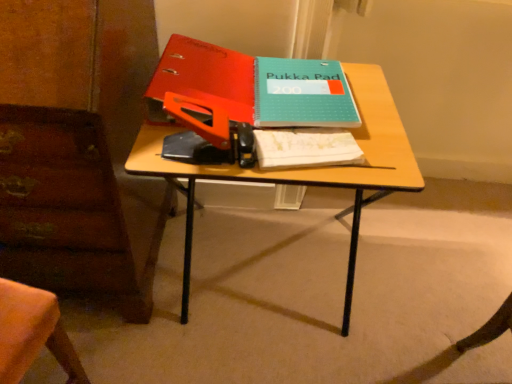
What are the coordinates of `matte orange binder at upper center, which appears as the 1th paperback book when viewed from the left` in the screenshot? It's located at (206, 76).

This screenshot has width=512, height=384. What do you see at coordinates (306, 168) in the screenshot?
I see `wooden desk at center` at bounding box center [306, 168].

This screenshot has width=512, height=384. I want to click on wooden desk at center, so click(306, 168).

Locate an element on the screen. This screenshot has width=512, height=384. teal matte notebook at center, which is the second paperback book from left to right is located at coordinates (302, 94).

Locate an element on the screen. The height and width of the screenshot is (384, 512). white paper notebook at center is located at coordinates (305, 148).

Is wooden desk at center turned away from white paper notebook at center?

wooden desk at center does not have its back to white paper notebook at center.

Is wooden desk at center far from white paper notebook at center?

No, there isn't a large distance between wooden desk at center and white paper notebook at center.

Where is `desk below the white paper notebook at center (from a real-world perspective)`? This screenshot has width=512, height=384. desk below the white paper notebook at center (from a real-world perspective) is located at coordinates (306, 168).

Considering the relative positions of wooden desk at center and white paper notebook at center in the image provided, is wooden desk at center behind white paper notebook at center?

No, wooden desk at center is closer to the camera.

Which object is thinner, white paper notebook at center or teal matte notebook at center, which ranks as the 1th paperback book in right-to-left order?

white paper notebook at center.

From the image's perspective, between white paper notebook at center and teal matte notebook at center, which is the second paperback book from left to right, which one is located above?

teal matte notebook at center, which is the second paperback book from left to right, appears higher in the image.

Based on the photo, can teal matte notebook at center, which ranks as the 1th paperback book in right-to-left order, be found inside white paper notebook at center?

Definitely not — teal matte notebook at center, which ranks as the 1th paperback book in right-to-left order, is not inside white paper notebook at center.

Could you tell me if matte orange binder at upper center, which appears as the 1th paperback book when viewed from the left, is turned towards teal matte notebook at center, which is the second paperback book from left to right?

Answer: No, matte orange binder at upper center, which appears as the 1th paperback book when viewed from the left, is not facing towards teal matte notebook at center, which is the second paperback book from left to right.

Considering their positions, is matte orange binder at upper center, which appears as the 1th paperback book when viewed from the left, located in front of or behind teal matte notebook at center, which is the second paperback book from left to right?

matte orange binder at upper center, which appears as the 1th paperback book when viewed from the left, is positioned closer to the viewer than teal matte notebook at center, which is the second paperback book from left to right.

How different are the orientations of matte orange binder at upper center, which appears as the 1th paperback book when viewed from the left, and teal matte notebook at center, which ranks as the 1th paperback book in right-to-left order, in degrees?

There is a 3.36-degree angle between the facing directions of matte orange binder at upper center, which appears as the 1th paperback book when viewed from the left, and teal matte notebook at center, which ranks as the 1th paperback book in right-to-left order.

Who is taller, matte orange binder at upper center, which appears as the 1th paperback book when viewed from the left, or teal matte notebook at center, which is the second paperback book from left to right?

matte orange binder at upper center, which appears as the 1th paperback book when viewed from the left, is taller.

Looking at this image, in terms of size, does matte orange binder at upper center, the 2th paperback book viewed from the right, appear bigger or smaller than white paper notebook at center?

Clearly, matte orange binder at upper center, the 2th paperback book viewed from the right, is larger in size than white paper notebook at center.

From the picture: Could you measure the distance between matte orange binder at upper center, the 2th paperback book viewed from the right, and white paper notebook at center?

matte orange binder at upper center, the 2th paperback book viewed from the right, and white paper notebook at center are 8.10 inches apart.

How many degrees apart are the facing directions of matte orange binder at upper center, the 2th paperback book viewed from the right, and white paper notebook at center?

Result: 11.4 degrees separate the facing orientations of matte orange binder at upper center, the 2th paperback book viewed from the right, and white paper notebook at center.

Which of these two, matte orange binder at upper center, which appears as the 1th paperback book when viewed from the left, or white paper notebook at center, is wider?

Wider between the two is matte orange binder at upper center, which appears as the 1th paperback book when viewed from the left.

Is point (353, 163) more distant than point (376, 182)?

Yes, point (353, 163) is farther from viewer.

Is white paper notebook at center with wooden desk at center?

Yes, white paper notebook at center and wooden desk at center clearly make contact.

In the image, is white paper notebook at center on the left side or the right side of wooden desk at center?

Based on their positions, white paper notebook at center is located to the right of wooden desk at center.

Looking at this image, from a real-world perspective, between white paper notebook at center and wooden desk at center, who is vertically higher?

white paper notebook at center is physically above.

Does teal matte notebook at center, which is the second paperback book from left to right, appear on the right side of matte orange binder at upper center, which appears as the 1th paperback book when viewed from the left?

Yes.

In the scene shown: Are teal matte notebook at center, which ranks as the 1th paperback book in right-to-left order, and matte orange binder at upper center, the 2th paperback book viewed from the right, located far from each other?

No, there isn't a large distance between teal matte notebook at center, which ranks as the 1th paperback book in right-to-left order, and matte orange binder at upper center, the 2th paperback book viewed from the right.

How different are the orientations of teal matte notebook at center, which ranks as the 1th paperback book in right-to-left order, and matte orange binder at upper center, the 2th paperback book viewed from the right, in degrees?

The angle between the facing direction of teal matte notebook at center, which ranks as the 1th paperback book in right-to-left order, and the facing direction of matte orange binder at upper center, the 2th paperback book viewed from the right, is 3.36 degrees.

From the image's perspective, which one is positioned lower, teal matte notebook at center, which is the second paperback book from left to right, or matte orange binder at upper center, the 2th paperback book viewed from the right?

teal matte notebook at center, which is the second paperback book from left to right, from the image's perspective.

From a real-world perspective, is wooden desk at center physically below teal matte notebook at center, which is the second paperback book from left to right?

Yes.

Is wooden desk at center looking in the opposite direction of teal matte notebook at center, which ranks as the 1th paperback book in right-to-left order?

No, teal matte notebook at center, which ranks as the 1th paperback book in right-to-left order, is not at the back of wooden desk at center.

Which of these two, wooden desk at center or teal matte notebook at center, which ranks as the 1th paperback book in right-to-left order, is smaller?

teal matte notebook at center, which ranks as the 1th paperback book in right-to-left order.

Can you tell me how much wooden desk at center and teal matte notebook at center, which ranks as the 1th paperback book in right-to-left order, differ in facing direction?

The facing directions of wooden desk at center and teal matte notebook at center, which ranks as the 1th paperback book in right-to-left order, are 4.18 degrees apart.

Where is `notebook above the wooden desk at center (from the image's perspective)`? Image resolution: width=512 pixels, height=384 pixels. notebook above the wooden desk at center (from the image's perspective) is located at coordinates (305, 148).

Identify the location of notebook below the teal matte notebook at center, which is the second paperback book from left to right (from the image's perspective). (305, 148).

Based on their spatial positions, is matte orange binder at upper center, the 2th paperback book viewed from the right, or white paper notebook at center closer to teal matte notebook at center, which is the second paperback book from left to right?

Among the two, white paper notebook at center is located nearer to teal matte notebook at center, which is the second paperback book from left to right.

Based on their spatial positions, is wooden desk at center or matte orange binder at upper center, the 2th paperback book viewed from the right, closer to teal matte notebook at center, which is the second paperback book from left to right?

Based on the image, matte orange binder at upper center, the 2th paperback book viewed from the right, appears to be nearer to teal matte notebook at center, which is the second paperback book from left to right.

Looking at the image, which one is located closer to matte orange binder at upper center, the 2th paperback book viewed from the right, teal matte notebook at center, which is the second paperback book from left to right, or wooden desk at center?

Among the two, teal matte notebook at center, which is the second paperback book from left to right, is located nearer to matte orange binder at upper center, the 2th paperback book viewed from the right.

Looking at this image, when comparing their distances from white paper notebook at center, does teal matte notebook at center, which is the second paperback book from left to right, or wooden desk at center seem further?

Based on the image, teal matte notebook at center, which is the second paperback book from left to right, appears to be further to white paper notebook at center.

From the image, which object appears to be farther from matte orange binder at upper center, the 2th paperback book viewed from the right, teal matte notebook at center, which ranks as the 1th paperback book in right-to-left order, or white paper notebook at center?

white paper notebook at center is positioned further to the anchor matte orange binder at upper center, the 2th paperback book viewed from the right.

Looking at the image, which one is located further to wooden desk at center, white paper notebook at center or teal matte notebook at center, which ranks as the 1th paperback book in right-to-left order?

Based on the image, teal matte notebook at center, which ranks as the 1th paperback book in right-to-left order, appears to be further to wooden desk at center.

Estimate the real-world distances between objects in this image. Which object is further from white paper notebook at center, teal matte notebook at center, which ranks as the 1th paperback book in right-to-left order, or matte orange binder at upper center, which appears as the 1th paperback book when viewed from the left?

Among the two, matte orange binder at upper center, which appears as the 1th paperback book when viewed from the left, is located further to white paper notebook at center.

Estimate the real-world distances between objects in this image. Which object is closer to wooden desk at center, matte orange binder at upper center, which appears as the 1th paperback book when viewed from the left, or teal matte notebook at center, which ranks as the 1th paperback book in right-to-left order?

teal matte notebook at center, which ranks as the 1th paperback book in right-to-left order, is positioned closer to the anchor wooden desk at center.

This screenshot has width=512, height=384. I want to click on notebook between teal matte notebook at center, which is the second paperback book from left to right, and wooden desk at center in the up-down direction, so click(305, 148).

You are a GUI agent. You are given a task and a screenshot of the screen. Output one action in this format:
    pyautogui.click(x=<x>, y=<y>)
    Task: Click on the notebook between matte orange binder at upper center, which appears as the 1th paperback book when viewed from the left, and wooden desk at center from top to bottom
    This screenshot has height=384, width=512.
    Given the screenshot: What is the action you would take?
    pyautogui.click(x=305, y=148)

At what (x,y) coordinates should I click in order to perform the action: click on paperback book between matte orange binder at upper center, the 2th paperback book viewed from the right, and wooden desk at center from top to bottom. Please return your answer as a coordinate pair (x, y). Looking at the image, I should click on 302,94.

Where is `notebook located between matte orange binder at upper center, which appears as the 1th paperback book when viewed from the left, and teal matte notebook at center, which ranks as the 1th paperback book in right-to-left order, in the left-right direction`? This screenshot has height=384, width=512. notebook located between matte orange binder at upper center, which appears as the 1th paperback book when viewed from the left, and teal matte notebook at center, which ranks as the 1th paperback book in right-to-left order, in the left-right direction is located at coordinates (305, 148).